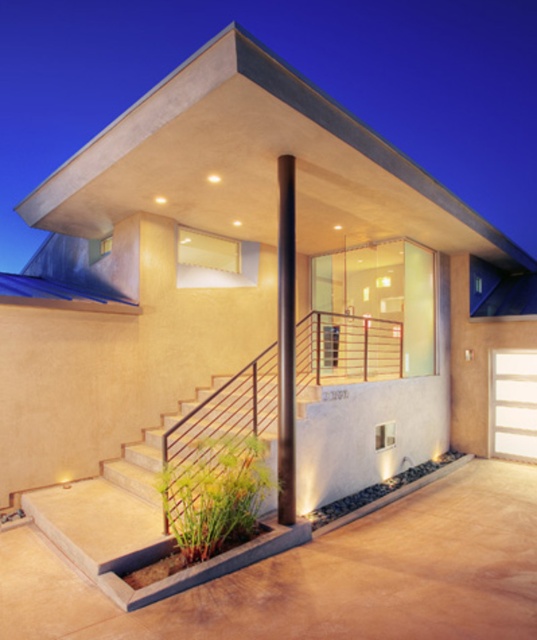
You are a delivery person trying to reach the entrance of the house. You see the smooth concrete stairs at center and the white wood garage door at center. Which object is closer to you as you approach the house?

The smooth concrete stairs at center is in front of the white wood garage door at center, so it is closer to you as you approach the house.

From the picture: You are standing at the entrance of the building and want to locate the black polished pole at center. Based on the 2D coordinates provided, in which direction should you look to find it?

The black polished pole at center is located at the coordinates point (286, 342), which is slightly to the right and slightly above the center point of the image. Therefore, you should look slightly to the right and upwards from the exact center to locate it.